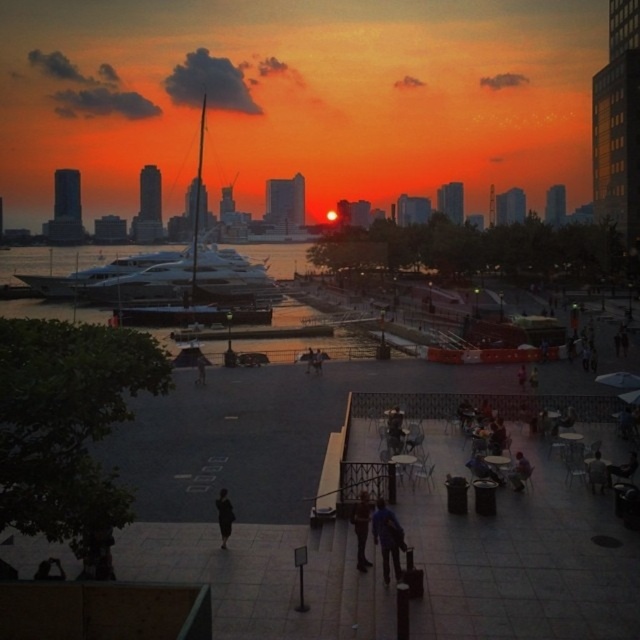
Question: Which point is farther from the camera taking this photo?

Choices:
 (A) (387, 513)
 (B) (596, 483)
 (C) (189, 320)
 (D) (513, 470)

Answer: (C)

Question: Can you confirm if dark blue fabric at center is wider than dark blue jeans at center?

Choices:
 (A) no
 (B) yes

Answer: (B)

Question: Considering the relative positions of dark blue jeans at center and dark gray fabric chair at lower right in the image provided, where is dark blue jeans at center located with respect to dark gray fabric chair at lower right?

Choices:
 (A) right
 (B) left

Answer: (B)

Question: Based on their relative distances, which object is farther from the dark fabric person at center?

Choices:
 (A) light brown wooden chair at center
 (B) dark blue jeans at center
 (C) shiny white yacht at left

Answer: (C)

Question: Can you confirm if dark blue jeans at center is positioned to the left of dark gray fabric chair at lower right?

Choices:
 (A) yes
 (B) no

Answer: (A)

Question: Which object is the farthest from the light brown wooden chair at center?

Choices:
 (A) dark gray fabric chair at lower right
 (B) dark blue fabric at center
 (C) dark fabric person at center
 (D) shiny white yacht at left

Answer: (D)